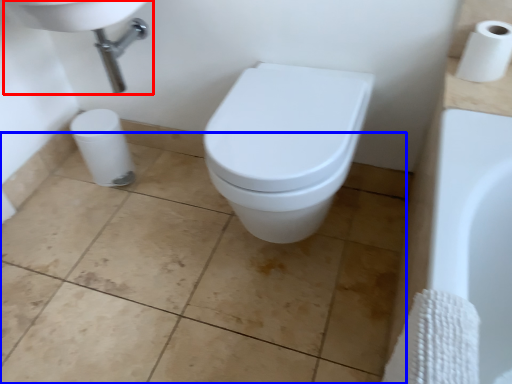
Question: Among these objects, which one is farthest to the camera, sink (highlighted by a red box) or ceramic tile (highlighted by a blue box)?

Choices:
 (A) sink
 (B) ceramic tile

Answer: (A)